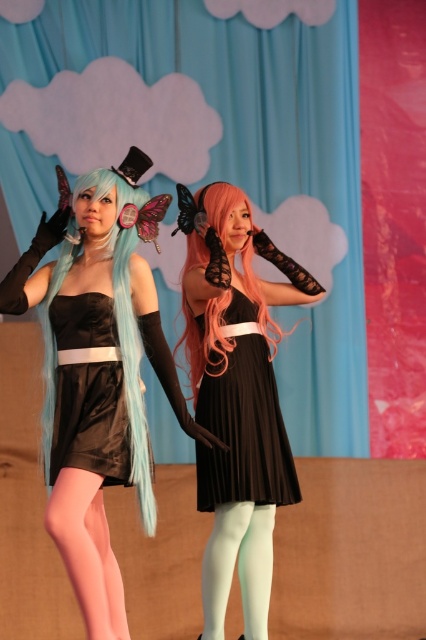
Question: Does satin black dress at center appear on the left side of pink satin tights at lower left?

Choices:
 (A) yes
 (B) no

Answer: (B)

Question: Which point is closer to the camera?

Choices:
 (A) pink satin tights at lower left
 (B) black pleated dress at center
 (C) pink silky hair at center

Answer: (A)

Question: Is black pleated dress at center bigger than pink silky hair at center?

Choices:
 (A) yes
 (B) no

Answer: (B)

Question: Which object is closer to the camera taking this photo?

Choices:
 (A) matte black dress at center
 (B) black pleated dress at center
 (C) satin black dress at center
 (D) pink satin tights at lower left

Answer: (D)

Question: Is black pleated dress at center above pink silky hair at center?

Choices:
 (A) no
 (B) yes

Answer: (A)

Question: Which object is closer to the camera taking this photo?

Choices:
 (A) satin black dress at center
 (B) matte black dress at center
 (C) black pleated dress at center

Answer: (A)